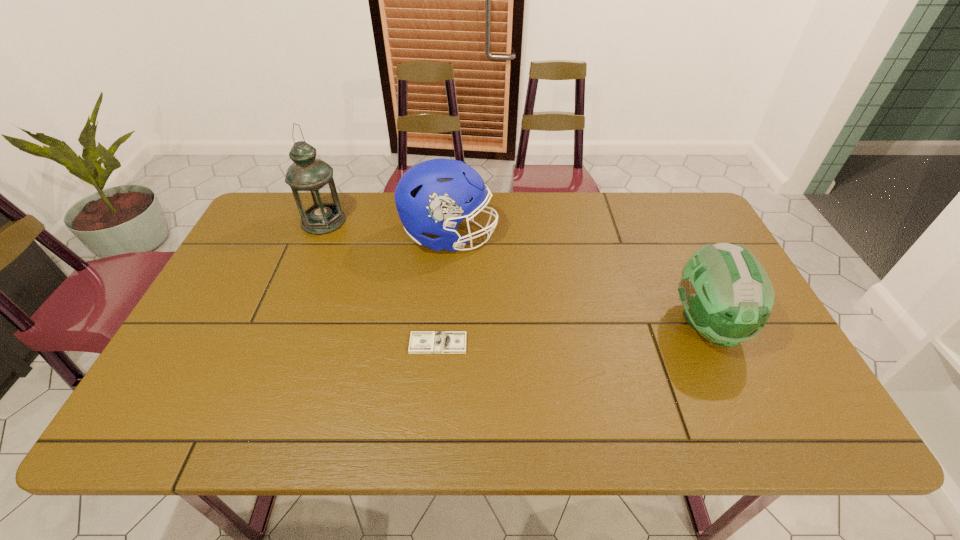
Locate an element on the screen. object that is the closest to the left football helmet is located at coordinates (311, 180).